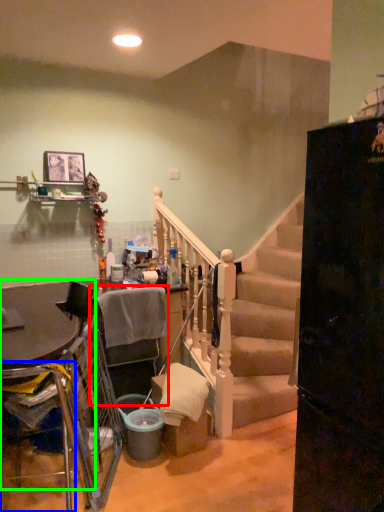
Question: Estimate the real-world distances between objects in this image. Which object is closer to armchair (highlighted by a red box), armchair (highlighted by a blue box) or table (highlighted by a green box)?

Choices:
 (A) armchair
 (B) table

Answer: (B)